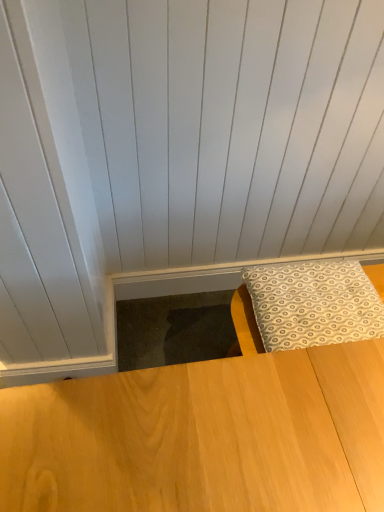
What do you see at coordinates (313, 304) in the screenshot?
I see `patterned fabric pillow at lower right` at bounding box center [313, 304].

I want to click on patterned fabric pillow at lower right, so click(x=313, y=304).

The width and height of the screenshot is (384, 512). I want to click on patterned fabric pillow at lower right, so click(313, 304).